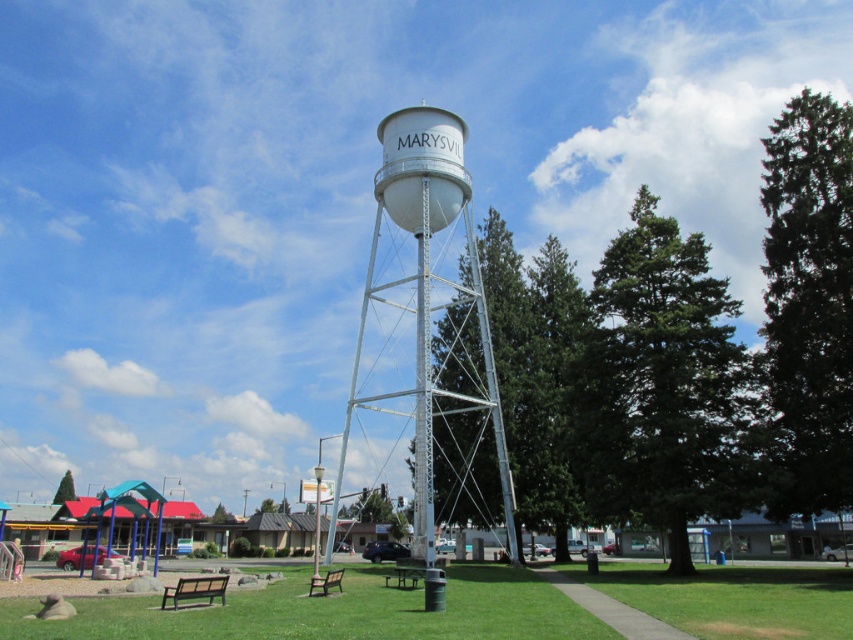
Question: Which of the following is the farthest from the observer?

Choices:
 (A) (368, 336)
 (B) (401, 568)

Answer: (A)

Question: Where is white metallic water tower at center located in relation to brown wooden picnic table at center in the image?

Choices:
 (A) right
 (B) left

Answer: (A)

Question: Which point is closer to the camera?

Choices:
 (A) (431, 237)
 (B) (399, 579)

Answer: (B)

Question: Does white metallic water tower at center appear on the right side of brown wooden picnic table at center?

Choices:
 (A) no
 (B) yes

Answer: (B)

Question: Is white metallic water tower at center bigger than brown wooden picnic table at center?

Choices:
 (A) yes
 (B) no

Answer: (A)

Question: Which of the following is the farthest from the observer?

Choices:
 (A) white metallic water tower at center
 (B) brown wooden picnic table at center

Answer: (B)